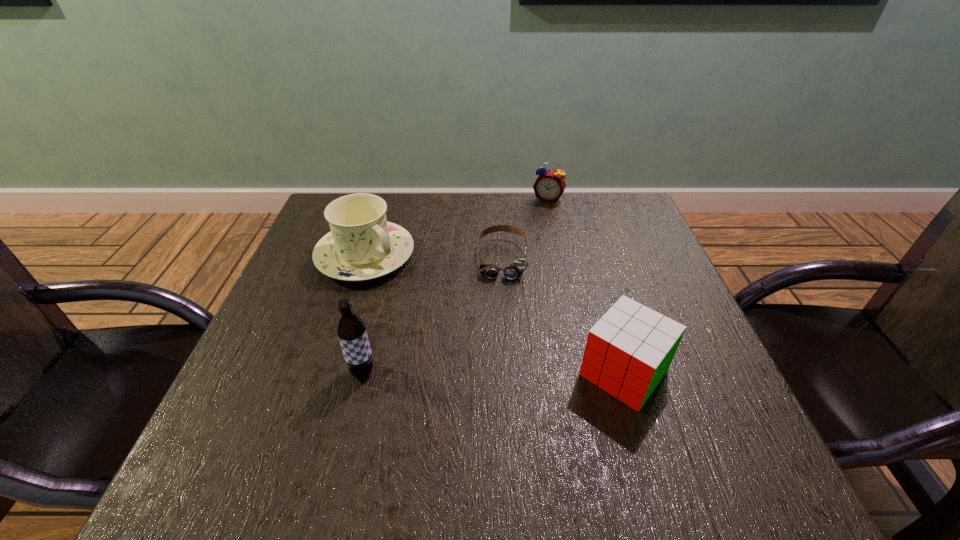
This screenshot has height=540, width=960. Identify the location of object that is at the near edge. (628, 351).

In order to click on object at the left edge in this screenshot , I will do `click(362, 245)`.

Find the location of a particular element. The image size is (960, 540). object that is at the right edge is located at coordinates pos(628,351).

The image size is (960, 540). What are the coordinates of `object present at the far left corner` in the screenshot? It's located at (362, 245).

At what (x,y) coordinates should I click in order to perform the action: click on object situated at the near right corner. Please return your answer as a coordinate pair (x, y). Image resolution: width=960 pixels, height=540 pixels. Looking at the image, I should click on (628, 351).

In the image, there is a desktop. Identify the location of vacant space at the far edge. The width and height of the screenshot is (960, 540). (426, 201).

In the image, there is a desktop. Identify the location of free space at the near edge. This screenshot has height=540, width=960. (355, 417).

You are a GUI agent. You are given a task and a screenshot of the screen. Output one action in this format:
    pyautogui.click(x=<x>, y=<y>)
    Task: Click on the vacant space at the left edge
    
    Given the screenshot: What is the action you would take?
    pyautogui.click(x=336, y=311)

At what (x,y) coordinates should I click in order to perform the action: click on free space at the right edge of the desktop. Please return your answer as a coordinate pair (x, y). The width and height of the screenshot is (960, 540). Looking at the image, I should click on (638, 300).

In the image, there is a desktop. Identify the location of vacant space at the far right corner. The height and width of the screenshot is (540, 960). (632, 226).